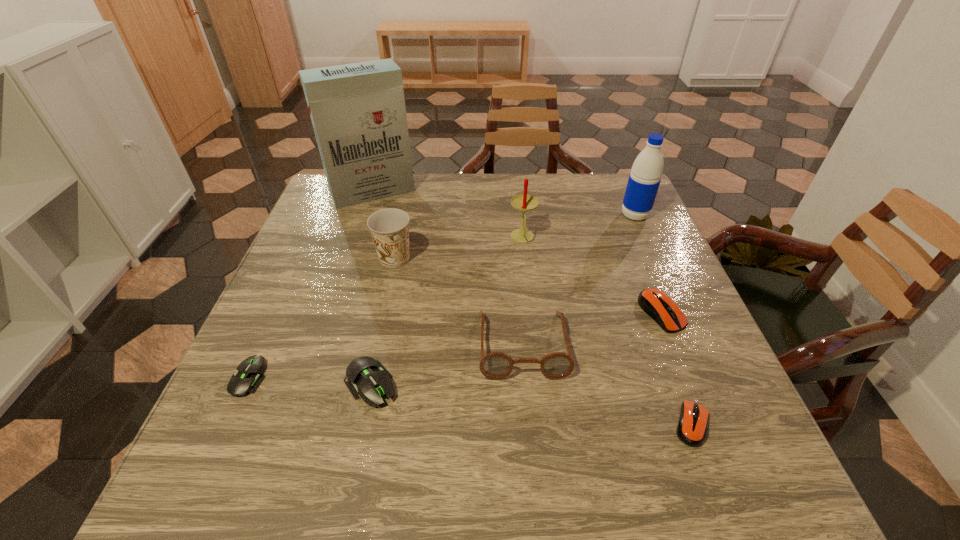
In order to click on object present at the far right corner in this screenshot , I will do `click(645, 177)`.

I want to click on object situated at the near right corner, so click(x=692, y=426).

Locate an element on the screen. Image resolution: width=960 pixels, height=540 pixels. vacant space at the far edge of the desktop is located at coordinates (406, 202).

This screenshot has height=540, width=960. In the image, there is a desktop. In order to click on vacant space at the near edge in this screenshot , I will do `click(470, 490)`.

In the image, there is a desktop. Identify the location of vacant space at the left edge. Image resolution: width=960 pixels, height=540 pixels. (276, 345).

Image resolution: width=960 pixels, height=540 pixels. Find the location of `vacant space at the right edge`. vacant space at the right edge is located at coordinates (670, 345).

I want to click on vacant space at the far right corner of the desktop, so click(613, 214).

Find the location of a particular element. Image resolution: width=960 pixels, height=540 pixels. vacant region at the near right corner of the desktop is located at coordinates (679, 484).

Find the location of a particular element. The image size is (960, 540). empty location between the leftmost computer mouse and the fifth shortest object is located at coordinates (386, 361).

Where is `empty space between the tallest object and the spectacles`? The image size is (960, 540). empty space between the tallest object and the spectacles is located at coordinates (447, 268).